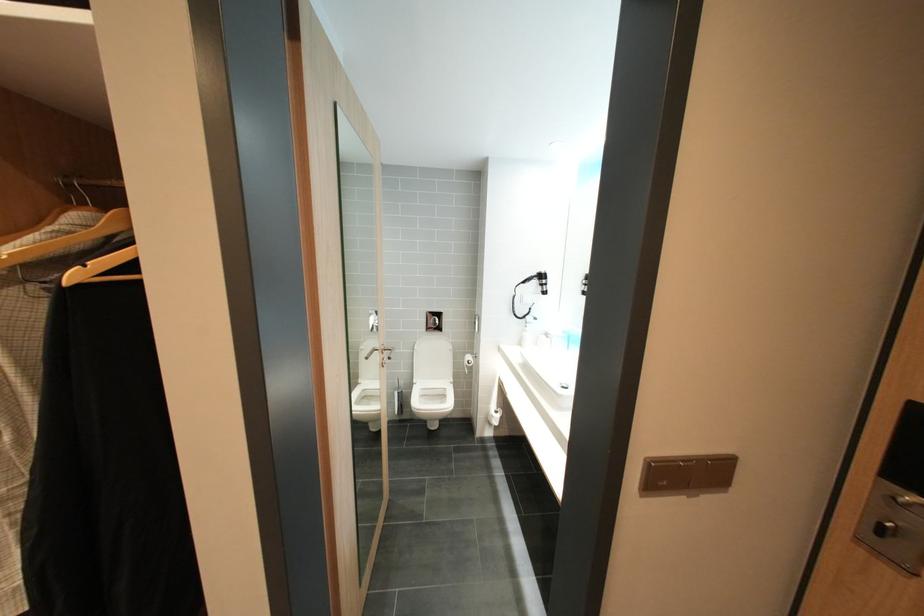
Image resolution: width=924 pixels, height=616 pixels. I want to click on brown light switch, so click(687, 474).